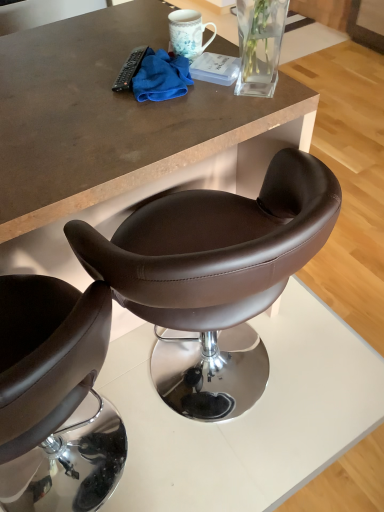
Question: Is brown leather chair at center oriented away from matte brown leather stool at center?

Choices:
 (A) yes
 (B) no

Answer: (B)

Question: From a real-world perspective, does brown leather chair at center stand above matte brown leather stool at center?

Choices:
 (A) yes
 (B) no

Answer: (B)

Question: Can you confirm if brown leather chair at center is shorter than matte brown leather stool at center?

Choices:
 (A) no
 (B) yes

Answer: (B)

Question: Is brown leather chair at center bigger than matte brown leather stool at center?

Choices:
 (A) no
 (B) yes

Answer: (A)

Question: Does brown leather chair at center have a greater height compared to matte brown leather stool at center?

Choices:
 (A) no
 (B) yes

Answer: (A)

Question: Does brown leather chair at center have a smaller size compared to matte brown leather stool at center?

Choices:
 (A) no
 (B) yes

Answer: (B)

Question: Considering the relative sizes of brown leather chair at center and black plastic remote control at upper center in the image provided, is brown leather chair at center thinner than black plastic remote control at upper center?

Choices:
 (A) yes
 (B) no

Answer: (B)

Question: Considering the relative sizes of brown leather chair at center and black plastic remote control at upper center in the image provided, is brown leather chair at center smaller than black plastic remote control at upper center?

Choices:
 (A) no
 (B) yes

Answer: (A)

Question: Would you say brown leather chair at center contains black plastic remote control at upper center?

Choices:
 (A) yes
 (B) no

Answer: (B)

Question: Is brown leather chair at center completely or partially outside of black plastic remote control at upper center?

Choices:
 (A) yes
 (B) no

Answer: (A)

Question: From a real-world perspective, is brown leather chair at center physically below black plastic remote control at upper center?

Choices:
 (A) no
 (B) yes

Answer: (B)

Question: Is brown leather chair at center bigger than black plastic remote control at upper center?

Choices:
 (A) no
 (B) yes

Answer: (B)

Question: From a real-world perspective, is brown leather chair at center over blue microfiber cloth at upper center?

Choices:
 (A) yes
 (B) no

Answer: (B)